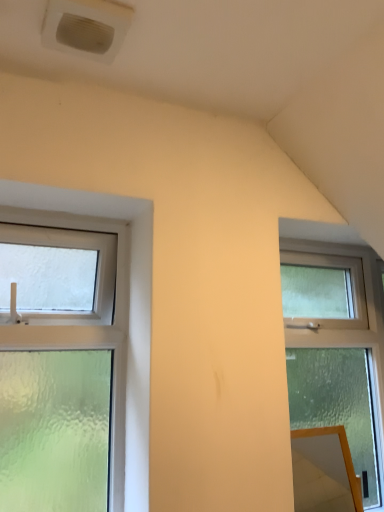
Locate an element on the screen. clear glass window at left, placed as the second window when sorted from right to left is located at coordinates (103, 326).

From the image's perspective, is orange glossy mirror at lower right located above or below white plastic air conditioning unit at upper left?

Clearly, from the image's perspective, orange glossy mirror at lower right is below white plastic air conditioning unit at upper left.

Is orange glossy mirror at lower right directly adjacent to white plastic air conditioning unit at upper left?

No, orange glossy mirror at lower right is not with white plastic air conditioning unit at upper left.

Is orange glossy mirror at lower right situated inside white plastic air conditioning unit at upper left or outside?

orange glossy mirror at lower right is not enclosed by white plastic air conditioning unit at upper left.

From a real-world perspective, which object rests below the other?

From a 3D spatial view, orange glossy mirror at lower right is below.

Looking at this image, is clear glass window at left, the 1th window viewed from the left, touching orange glossy mirror at lower right?

clear glass window at left, the 1th window viewed from the left, and orange glossy mirror at lower right are clearly separated.

Is clear glass window at left, the 1th window viewed from the left, positioned beyond the bounds of orange glossy mirror at lower right?

Absolutely, clear glass window at left, the 1th window viewed from the left, is external to orange glossy mirror at lower right.

Is clear glass window at left, the 1th window viewed from the left, at the right side of orange glossy mirror at lower right?

Incorrect, clear glass window at left, the 1th window viewed from the left, is not on the right side of orange glossy mirror at lower right.

Is orange glossy mirror at lower right oriented away from clear glass window at left, placed as the second window when sorted from right to left?

No, orange glossy mirror at lower right is not facing the opposite direction of clear glass window at left, placed as the second window when sorted from right to left.

Is orange glossy mirror at lower right beside clear glass window at left, placed as the second window when sorted from right to left?

No, orange glossy mirror at lower right is not in contact with clear glass window at left, placed as the second window when sorted from right to left.

Could you tell me if clear frosted glass window at right, the 2th window from the left, is turned towards white plastic air conditioning unit at upper left?

No.

Is white plastic air conditioning unit at upper left located within clear frosted glass window at right, the first window viewed from the right?

No, white plastic air conditioning unit at upper left is not inside clear frosted glass window at right, the first window viewed from the right.

Considering the positions of objects clear frosted glass window at right, the 2th window from the left, and white plastic air conditioning unit at upper left in the image provided, who is behind, clear frosted glass window at right, the 2th window from the left, or white plastic air conditioning unit at upper left?

clear frosted glass window at right, the 2th window from the left.

From a real-world perspective, which object stands above the other?

white plastic air conditioning unit at upper left is physically above.

Locate an element on the screen. air conditioning above the orange glossy mirror at lower right (from the image's perspective) is located at coordinates (86, 27).

Considering the relative sizes of white plastic air conditioning unit at upper left and orange glossy mirror at lower right in the image provided, is white plastic air conditioning unit at upper left taller than orange glossy mirror at lower right?

In fact, white plastic air conditioning unit at upper left may be shorter than orange glossy mirror at lower right.

Is white plastic air conditioning unit at upper left oriented away from orange glossy mirror at lower right?

That's not correct — white plastic air conditioning unit at upper left is not looking away from orange glossy mirror at lower right.

From a real-world perspective, is white plastic air conditioning unit at upper left located higher than orange glossy mirror at lower right?

Yes.

Which object is positioned more to the left, white plastic air conditioning unit at upper left or clear glass window at left, placed as the second window when sorted from right to left?

Positioned to the left is clear glass window at left, placed as the second window when sorted from right to left.

How much distance is there between white plastic air conditioning unit at upper left and clear glass window at left, the 1th window viewed from the left?

white plastic air conditioning unit at upper left is 23.07 inches away from clear glass window at left, the 1th window viewed from the left.

From the picture: Considering the sizes of objects white plastic air conditioning unit at upper left and clear glass window at left, placed as the second window when sorted from right to left, in the image provided, who is shorter, white plastic air conditioning unit at upper left or clear glass window at left, placed as the second window when sorted from right to left,?

Standing shorter between the two is white plastic air conditioning unit at upper left.

Considering the sizes of objects white plastic air conditioning unit at upper left and clear glass window at left, the 1th window viewed from the left, in the image provided, who is thinner, white plastic air conditioning unit at upper left or clear glass window at left, the 1th window viewed from the left,?

With smaller width is clear glass window at left, the 1th window viewed from the left.

Can you tell me how much clear glass window at left, placed as the second window when sorted from right to left, and white plastic air conditioning unit at upper left differ in facing direction?

The angle between the facing direction of clear glass window at left, placed as the second window when sorted from right to left, and the facing direction of white plastic air conditioning unit at upper left is 2.53 degrees.

Considering the sizes of objects clear glass window at left, placed as the second window when sorted from right to left, and white plastic air conditioning unit at upper left in the image provided, who is bigger, clear glass window at left, placed as the second window when sorted from right to left, or white plastic air conditioning unit at upper left?

clear glass window at left, placed as the second window when sorted from right to left, is bigger.

Which object is more forward, clear glass window at left, the 1th window viewed from the left, or white plastic air conditioning unit at upper left?

white plastic air conditioning unit at upper left.

From the picture: Is clear glass window at left, the 1th window viewed from the left, located outside white plastic air conditioning unit at upper left?

Yes, clear glass window at left, the 1th window viewed from the left, is not within white plastic air conditioning unit at upper left.

This screenshot has width=384, height=512. Find the location of `mirror below the white plastic air conditioning unit at upper left (from the image's perspective)`. mirror below the white plastic air conditioning unit at upper left (from the image's perspective) is located at coordinates (323, 471).

Locate an element on the screen. mirror behind the clear glass window at left, the 1th window viewed from the left is located at coordinates (323, 471).

Estimate the real-world distances between objects in this image. Which object is further from orange glossy mirror at lower right, clear glass window at left, the 1th window viewed from the left, or clear frosted glass window at right, the 2th window from the left?

clear glass window at left, the 1th window viewed from the left.

Looking at the image, which one is located closer to clear glass window at left, the 1th window viewed from the left, clear frosted glass window at right, the 2th window from the left, or white plastic air conditioning unit at upper left?

white plastic air conditioning unit at upper left.

Looking at the image, which one is located closer to clear glass window at left, the 1th window viewed from the left, clear frosted glass window at right, the 2th window from the left, or orange glossy mirror at lower right?

orange glossy mirror at lower right is positioned closer to the anchor clear glass window at left, the 1th window viewed from the left.

From the image, which object appears to be nearer to clear glass window at left, the 1th window viewed from the left, white plastic air conditioning unit at upper left or orange glossy mirror at lower right?

white plastic air conditioning unit at upper left is positioned closer to the anchor clear glass window at left, the 1th window viewed from the left.

Considering their positions, is orange glossy mirror at lower right positioned closer to clear frosted glass window at right, the 2th window from the left, than clear glass window at left, placed as the second window when sorted from right to left?

orange glossy mirror at lower right.

Based on their spatial positions, is clear frosted glass window at right, the first window viewed from the right, or white plastic air conditioning unit at upper left closer to orange glossy mirror at lower right?

clear frosted glass window at right, the first window viewed from the right, is closer to orange glossy mirror at lower right.

Considering their positions, is clear glass window at left, placed as the second window when sorted from right to left, positioned further to clear frosted glass window at right, the 2th window from the left, than white plastic air conditioning unit at upper left?

Based on the image, white plastic air conditioning unit at upper left appears to be further to clear frosted glass window at right, the 2th window from the left.

Looking at the image, which one is located closer to orange glossy mirror at lower right, clear glass window at left, the 1th window viewed from the left, or white plastic air conditioning unit at upper left?

The object closer to orange glossy mirror at lower right is clear glass window at left, the 1th window viewed from the left.

The width and height of the screenshot is (384, 512). Find the location of `air conditioning between clear glass window at left, placed as the second window when sorted from right to left, and clear frosted glass window at right, the 2th window from the left, from left to right`. air conditioning between clear glass window at left, placed as the second window when sorted from right to left, and clear frosted glass window at right, the 2th window from the left, from left to right is located at coordinates 86,27.

This screenshot has width=384, height=512. What are the coordinates of `mirror situated between clear glass window at left, placed as the second window when sorted from right to left, and clear frosted glass window at right, the first window viewed from the right, from left to right` in the screenshot? It's located at (323, 471).